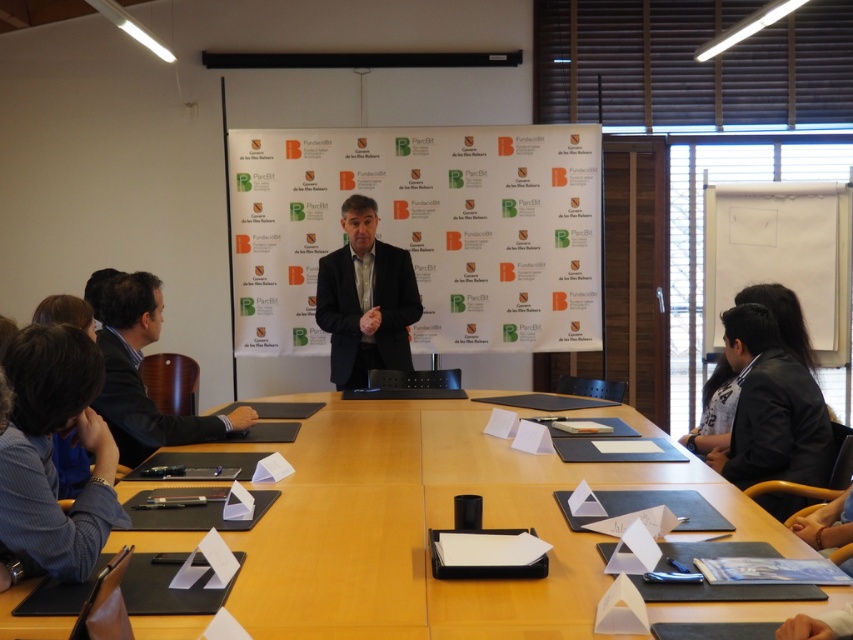
Is point (83, 444) farther from viewer compared to point (796, 250)?

No, it is in front of (796, 250).

You are a GUI agent. You are given a task and a screenshot of the screen. Output one action in this format:
    pyautogui.click(x=<x>, y=<y>)
    Task: Click on the blue shirt at left
    This screenshot has height=640, width=853.
    Given the screenshot: What is the action you would take?
    pyautogui.click(x=50, y=456)

Between point (91, 529) and point (778, 243), which one is positioned in front?

Point (91, 529) is in front.

Find the location of `blue shirt at left`. blue shirt at left is located at coordinates (50, 456).

Which is more to the right, dark gray woolen suit at center or dark blue fabric business suit at left?

dark gray woolen suit at center is more to the right.

Which is behind, point (349, 301) or point (222, 440)?

Positioned behind is point (349, 301).

What are the coordinates of `dark gray woolen suit at center` in the screenshot? It's located at (393, 304).

Is point (590, 609) positioned behind point (16, 538)?

No.

Is wooden table at center below blue shirt at left?

Yes, wooden table at center is below blue shirt at left.

Find the location of a particular element. The image size is (853, 640). wooden table at center is located at coordinates (434, 525).